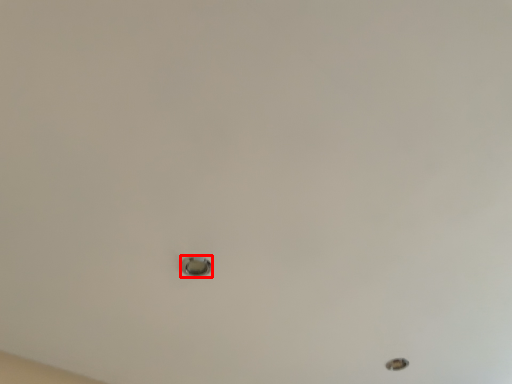
Question: Considering the relative positions of knob (annotated by the red box) and hole in the image provided, where is knob (annotated by the red box) located with respect to the staircase?

Choices:
 (A) left
 (B) right

Answer: (A)